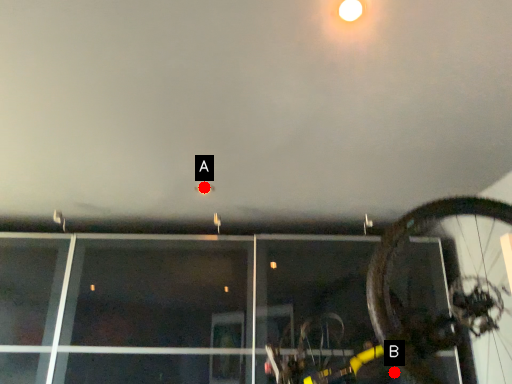
Question: Two points are circled on the image, labeled by A and B beside each circle. Which point is closer to the camera?

Choices:
 (A) A is closer
 (B) B is closer

Answer: (A)